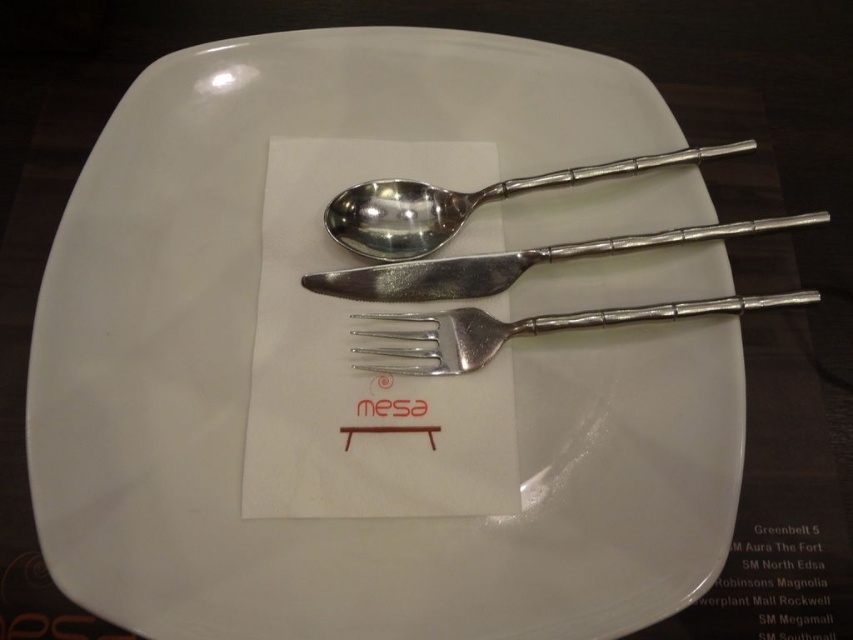
You are setting up a table for a formal dinner and need to place a polished silver knife at center. Where should you place it on the table?

You should place the polished silver knife at center at point coordinates (514, 262).

You are setting up a formal dinner and need to adjust the placement of the silver metallic fork at center and the polished silver knife at center. If you want to move the fork closer to the front of the plate, which direction should you move it relative to the knife?

The silver metallic fork at center is currently behind the polished silver knife at center. To move it closer to the front of the plate, you should move the fork forward so it is in front of the polished silver knife at center.

You are setting up a formal dinner and need to ensure that the utensils on the white plate are arranged properly. According to the image, which utensil, the polished silver knife at center or the silver metallic fork at center, should be placed higher up on the plate?

The polished silver knife at center should be placed higher up on the plate because it is taller than the silver metallic fork at center.